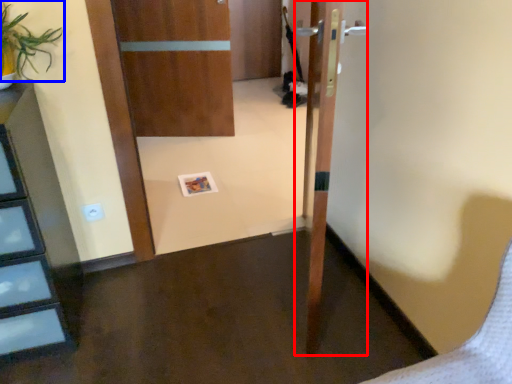
Question: Which object appears farthest to the camera in this image, door (highlighted by a red box) or plant (highlighted by a blue box)?

Choices:
 (A) door
 (B) plant

Answer: (B)